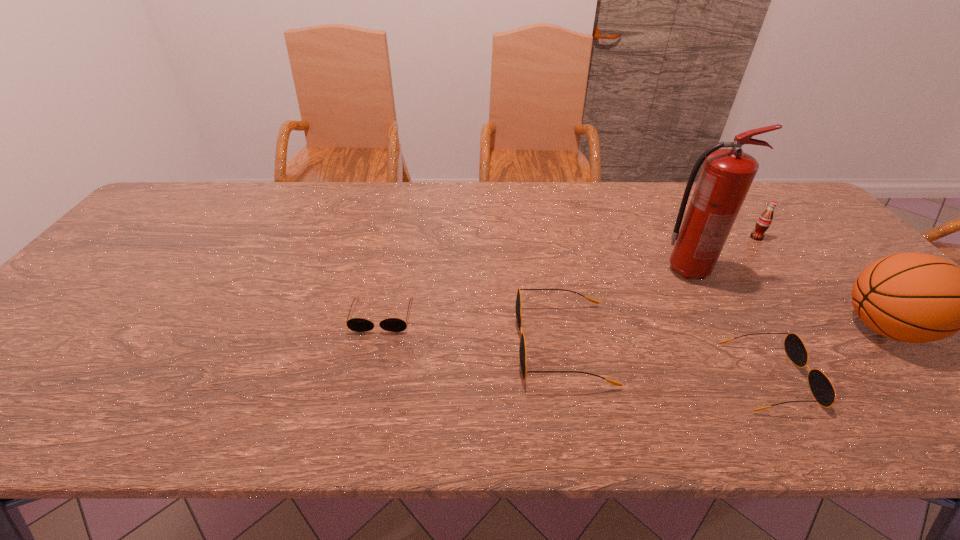
Identify the location of the fifth shortest object. (911, 297).

You are a GUI agent. You are given a task and a screenshot of the screen. Output one action in this format:
    pyautogui.click(x=<x>, y=<y>)
    Task: Click on the rightmost object
    The image size is (960, 540).
    Given the screenshot: What is the action you would take?
    pyautogui.click(x=911, y=297)

Find the location of a particular element. vacant space located on the front-facing side of the shortest object is located at coordinates (372, 357).

The height and width of the screenshot is (540, 960). Find the location of `vacant region located on the front-facing side of the second sunglasses from right to left`. vacant region located on the front-facing side of the second sunglasses from right to left is located at coordinates (451, 344).

Identify the location of free location located 0.320m on the front-facing side of the second sunglasses from right to left. This screenshot has width=960, height=540. (377, 344).

The image size is (960, 540). Identify the location of free spot located 0.340m on the front-facing side of the second sunglasses from right to left. (368, 344).

Find the location of a particular element. vacant region located on the front-facing side of the rightmost sunglasses is located at coordinates (940, 377).

Locate an element on the screen. The image size is (960, 540). vacant point located on the front of the soda is located at coordinates (836, 341).

Locate an element on the screen. The width and height of the screenshot is (960, 540). vacant position located on the handle side the tallest object is located at coordinates (811, 271).

I want to click on free space located on the back of the basketball, so click(840, 280).